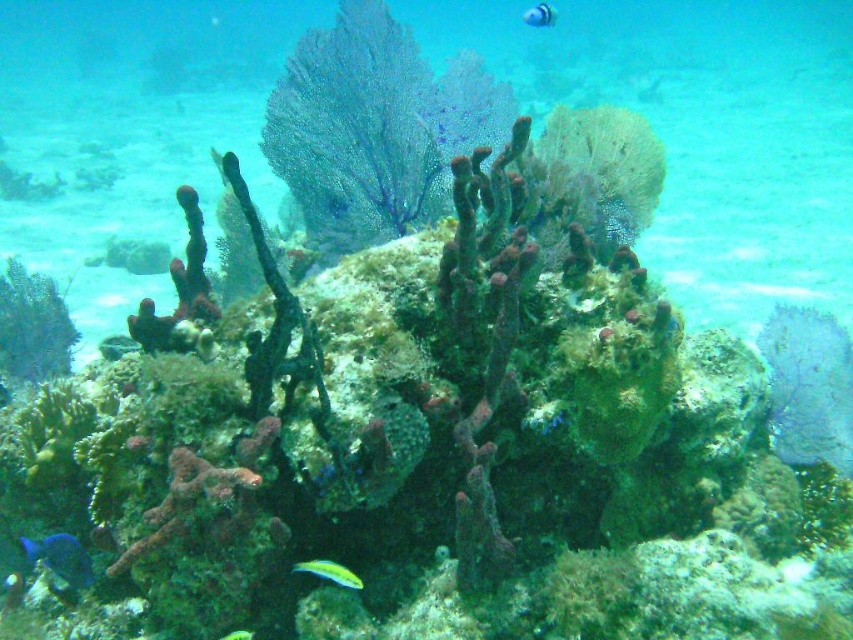
Is translucent purple coral at center above shiny yellow fish at center?

Correct, translucent purple coral at center is located above shiny yellow fish at center.

What do you see at coordinates (593, 177) in the screenshot?
I see `translucent purple coral at center` at bounding box center [593, 177].

Identify the location of translucent purple coral at center. (593, 177).

In the scene shown: Can you confirm if translucent purple coral at center is taller than shiny blue fish at lower left?

Yes.

Is point (656, 173) farther from camera compared to point (74, 580)?

That is True.

This screenshot has height=640, width=853. In order to click on translucent purple coral at center in this screenshot , I will do `click(593, 177)`.

Does shiny blue fish at lower left have a lesser width compared to blue glossy fish at upper center?

No.

This screenshot has width=853, height=640. Find the location of `shiny blue fish at lower left`. shiny blue fish at lower left is located at coordinates tap(61, 557).